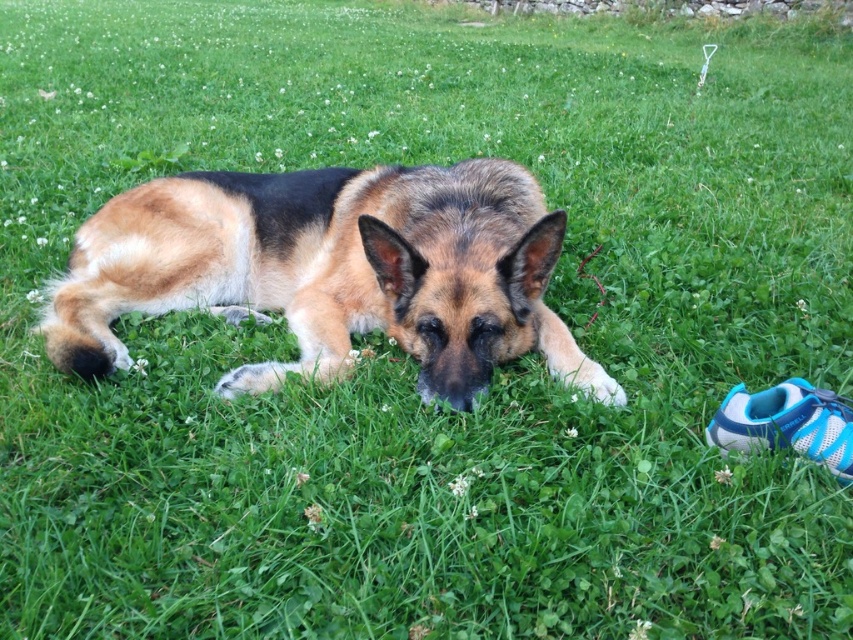
You are a photographer trying to capture a closeup of the blue mesh shoe at lower right without the brown and black fur dog at center blocking the view. Can you move the shoe to the front of the dog?

The blue mesh shoe at lower right is behind the brown and black fur dog at center, so moving the shoe to the front would require physically moving it in front of the dog to avoid obstruction.

You are a photographer standing at a certain distance from the brown and black fur dog at center. You want to take a closeup photo of the dog without moving your position. What should you do?

Since the brown and black fur dog at center is 6.05 feet away from the camera, you can use a zoom lens to get a closeup without moving closer.

You are a photographer trying to capture the brown and black fur dog at center and the blue mesh shoe at lower right in the same frame. Which object should you focus on first if you want to ensure both are in focus, considering their sizes?

The brown and black fur dog at center is larger in size than the blue mesh shoe at lower right, so you should focus on the brown and black fur dog at center first to ensure both are in focus.